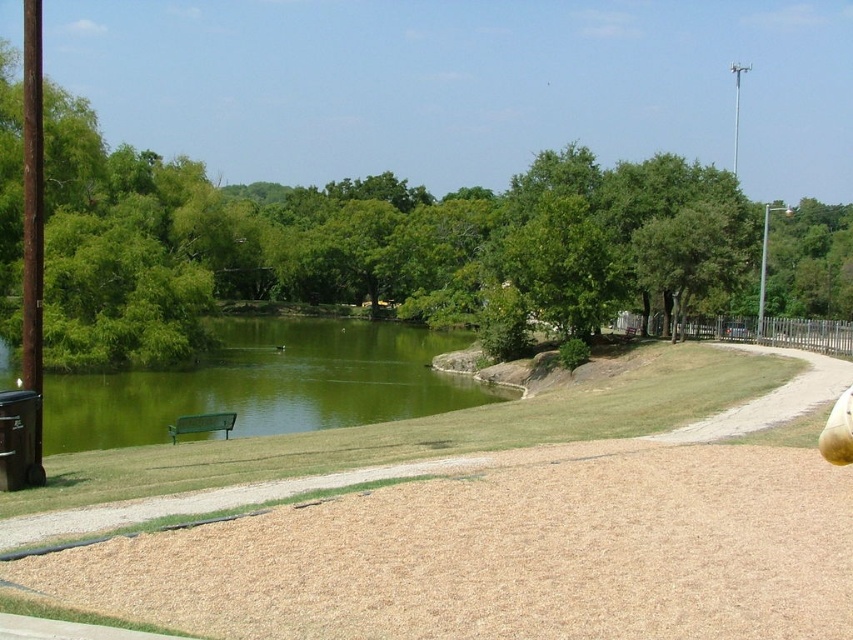
You are a park visitor who wants to sit on the green matte bench at lower left. As you walk along the dirt path, you notice brown wood chips at lower center. Are the wood chips in your way to the bench?

The brown wood chips at lower center are above the green matte bench at lower left, so they are not in your path to the bench.

You are a visitor in the park and want to sit on the green matte bench at lower left. However, there is green liquid water at lower left in your way. Can you walk directly to the bench without going around?

The green matte bench at lower left is behind the green liquid water at lower left, so you can walk directly to the bench without needing to go around since the bench is positioned behind the water.